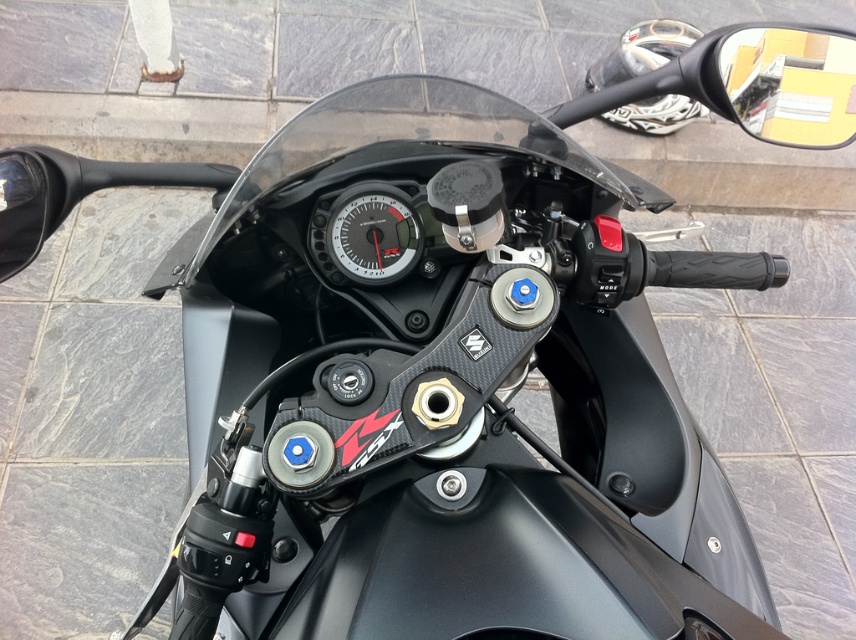
Question: Can you confirm if yellow matte side mirror at upper right is positioned above matte black speedometer at center?

Choices:
 (A) no
 (B) yes

Answer: (B)

Question: Among these objects, which one is farthest from the camera?

Choices:
 (A) yellow matte side mirror at upper right
 (B) matte black speedometer at center

Answer: (A)

Question: Is yellow matte side mirror at upper right thinner than matte black speedometer at center?

Choices:
 (A) yes
 (B) no

Answer: (B)

Question: Which of the following is the farthest from the observer?

Choices:
 (A) yellow matte side mirror at upper right
 (B) matte black speedometer at center

Answer: (A)

Question: Considering the relative positions of yellow matte side mirror at upper right and matte black speedometer at center in the image provided, where is yellow matte side mirror at upper right located with respect to matte black speedometer at center?

Choices:
 (A) left
 (B) right

Answer: (B)